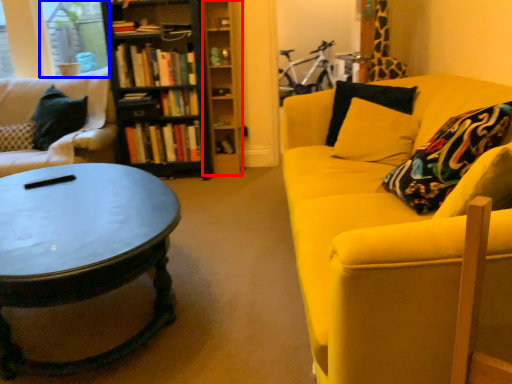
Question: Which object is further to the camera taking this photo, shelf (highlighted by a red box) or window screen (highlighted by a blue box)?

Choices:
 (A) shelf
 (B) window screen

Answer: (B)